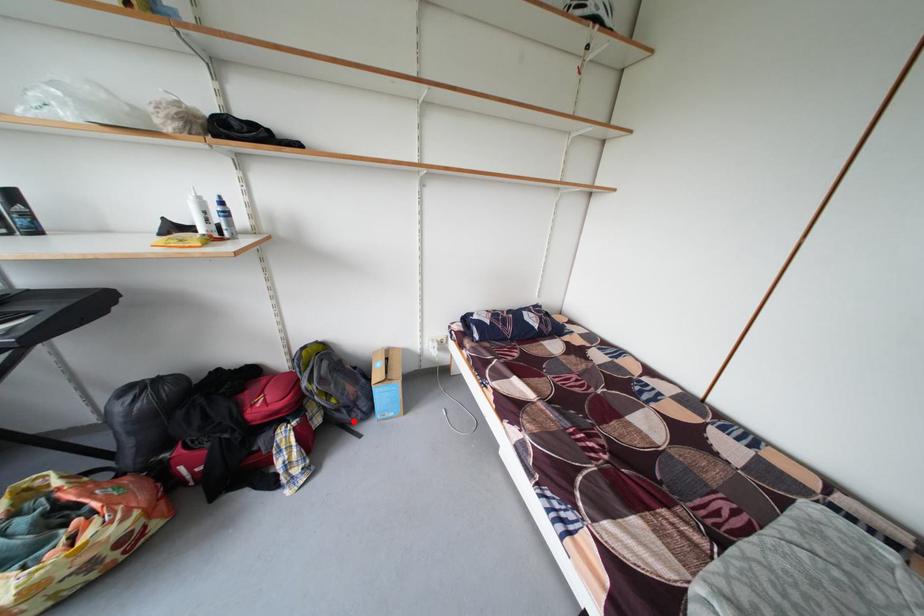
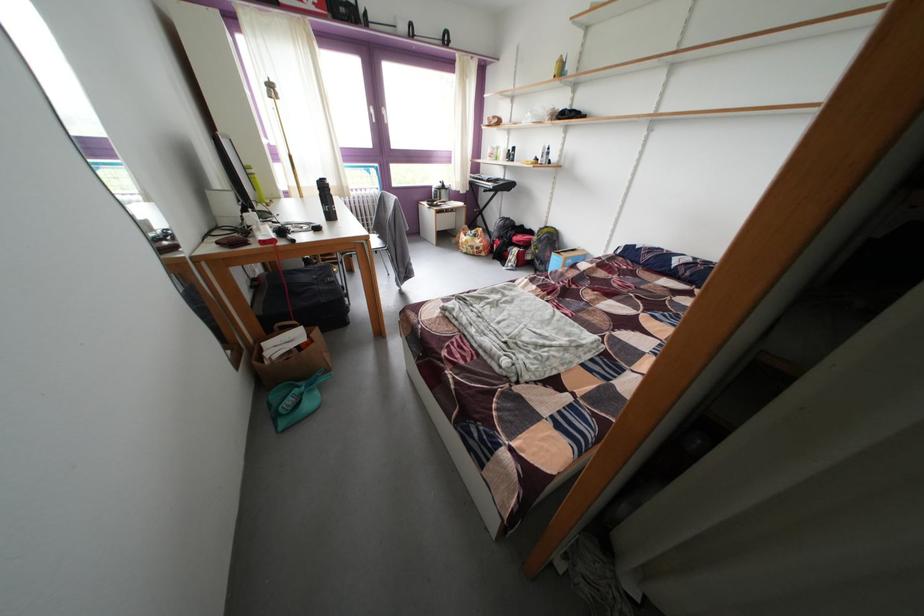
The point at the highlighted location is marked in the first image. Where is the corresponding point in the second image?

(548, 269)